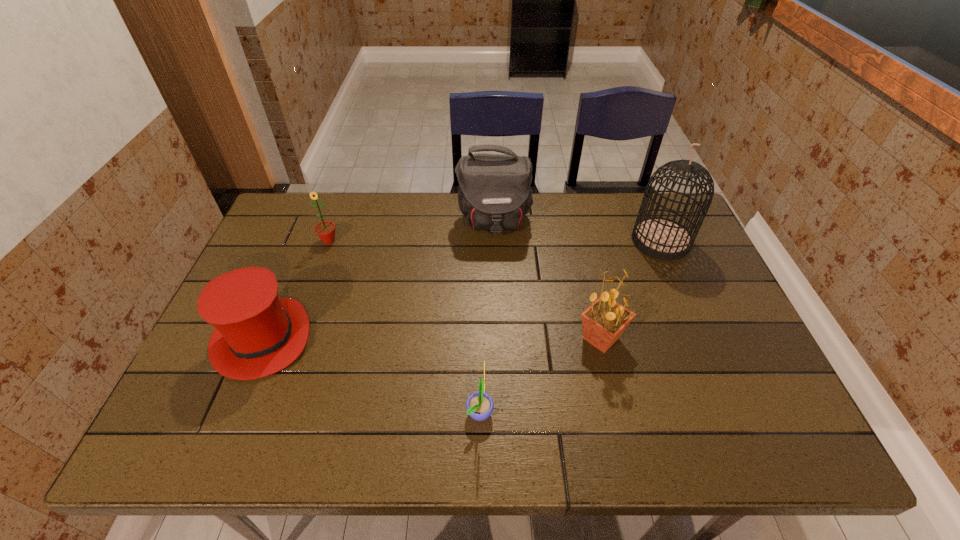
Locate an element on the screen. This screenshot has width=960, height=540. unoccupied position between the fourth shortest object and the farthest sunflower is located at coordinates (465, 289).

Identify which object is located as the third nearest to the hat. Please provide its 2D coordinates. Your answer should be formatted as a tuple, i.e. [(x, y)], where the tuple contains the x and y coordinates of a point satisfying the conditions above.

[(494, 193)]

Locate which object is the second closest to the third tallest object. Please provide its 2D coordinates. Your answer should be formatted as a tuple, i.e. [(x, y)], where the tuple contains the x and y coordinates of a point satisfying the conditions above.

[(661, 238)]

At what (x,y) coordinates should I click in order to perform the action: click on the closest sunflower to the farthest sunflower. Please return your answer as a coordinate pair (x, y). The height and width of the screenshot is (540, 960). Looking at the image, I should click on (479, 405).

Select which sunflower appears as the second closest to the nearest object. Please provide its 2D coordinates. Your answer should be formatted as a tuple, i.e. [(x, y)], where the tuple contains the x and y coordinates of a point satisfying the conditions above.

[(325, 230)]

Locate an element on the screen. vacant region that satisfies the following two spatial constraints: 1. on the front side of the birdcage; 2. on the front-facing side of the nearest sunflower is located at coordinates (733, 411).

Where is `vacant region that satisfies the following two spatial constraints: 1. on the open flap of the shoulder bag; 2. on the front-facing side of the nearest sunflower`? vacant region that satisfies the following two spatial constraints: 1. on the open flap of the shoulder bag; 2. on the front-facing side of the nearest sunflower is located at coordinates (500, 411).